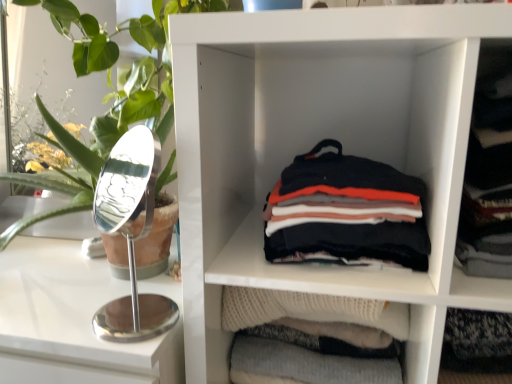
Locate an element on the screen. The width and height of the screenshot is (512, 384). free spot below green leafy plant at left (from a real-world perspective) is located at coordinates (66, 282).